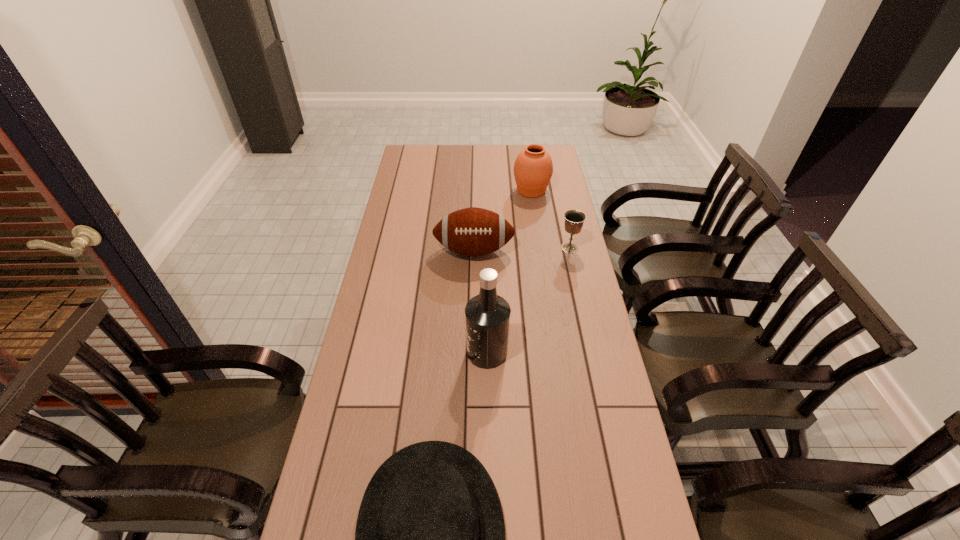
In order to click on vacant space that satisfies the following two spatial constraints: 1. on the front side of the urn; 2. on the front label of the tallest object in this screenshot , I will do `click(556, 352)`.

This screenshot has width=960, height=540. Find the location of `vacant space that satisfies the following two spatial constraints: 1. on the front side of the second shortest object; 2. on the front label of the liquor`. vacant space that satisfies the following two spatial constraints: 1. on the front side of the second shortest object; 2. on the front label of the liquor is located at coordinates (593, 352).